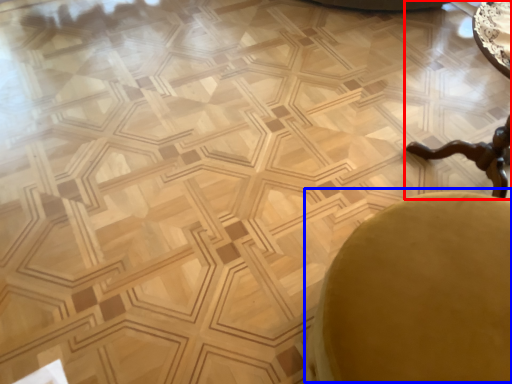
Question: Which of the following is the closest to the observer, cocktail table (highlighted by a red box) or swivel chair (highlighted by a blue box)?

Choices:
 (A) cocktail table
 (B) swivel chair

Answer: (B)